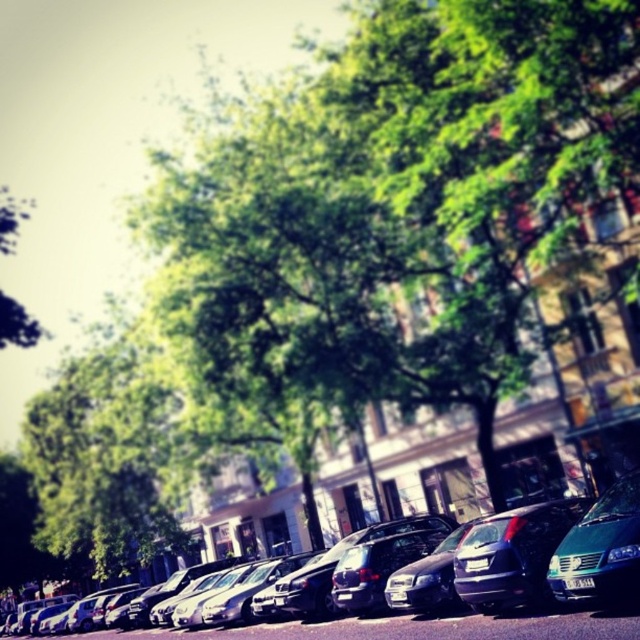
Which is below, green leafy tree at center or teal matte van at lower right?

Positioned lower is green leafy tree at center.

Is green leafy tree at center behind teal matte van at lower right?

Yes, green leafy tree at center is behind teal matte van at lower right.

Where is `green leafy tree at center`? Image resolution: width=640 pixels, height=640 pixels. green leafy tree at center is located at coordinates (104, 461).

Between shiny metallic sedan at center and teal matte van at lower right, which one has less height?

teal matte van at lower right is shorter.

Can you confirm if shiny metallic sedan at center is taller than teal matte van at lower right?

Yes.

Which is in front, point (525, 632) or point (614, 531)?

Point (614, 531)

Where is `shiny metallic sedan at center`? The height and width of the screenshot is (640, 640). shiny metallic sedan at center is located at coordinates (406, 628).

Can you confirm if green leafy tree at center is shorter than shiny metallic sedan at center?

Incorrect, green leafy tree at center's height does not fall short of shiny metallic sedan at center's.

Can you confirm if green leafy tree at center is thinner than shiny metallic sedan at center?

No.

Is point (109, 410) farther from camera compared to point (509, 620)?

That is True.

This screenshot has height=640, width=640. In order to click on green leafy tree at center in this screenshot , I will do `click(104, 461)`.